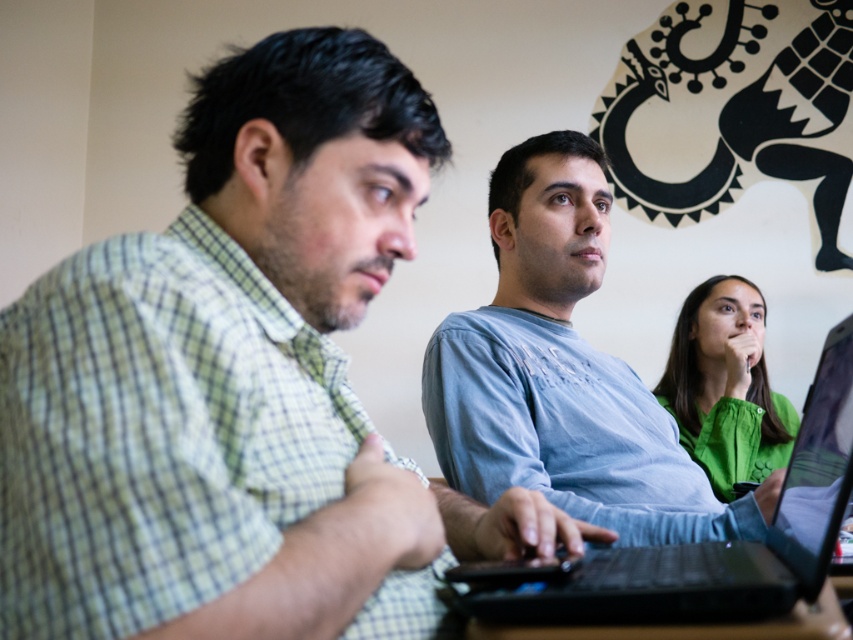
Question: Does light blue cotton shirt at center have a greater width compared to black matte laptop at center?

Choices:
 (A) yes
 (B) no

Answer: (A)

Question: Is black matte laptop at center closer to camera compared to green matte shirt at upper right?

Choices:
 (A) yes
 (B) no

Answer: (A)

Question: Among these objects, which one is farthest from the camera?

Choices:
 (A) black matte laptop at center
 (B) black plastic table at lower center
 (C) green matte shirt at upper right

Answer: (C)

Question: Does light blue cotton shirt at center appear over black matte laptop at center?

Choices:
 (A) no
 (B) yes

Answer: (B)

Question: Which of the following is the farthest from the observer?

Choices:
 (A) (846, 628)
 (B) (828, 365)
 (C) (560, 291)
 (D) (732, 349)

Answer: (D)

Question: Which of the following is the farthest from the observer?

Choices:
 (A) green checkered shirt at left
 (B) black plastic table at lower center
 (C) black matte laptop at center
 (D) green matte shirt at upper right

Answer: (D)